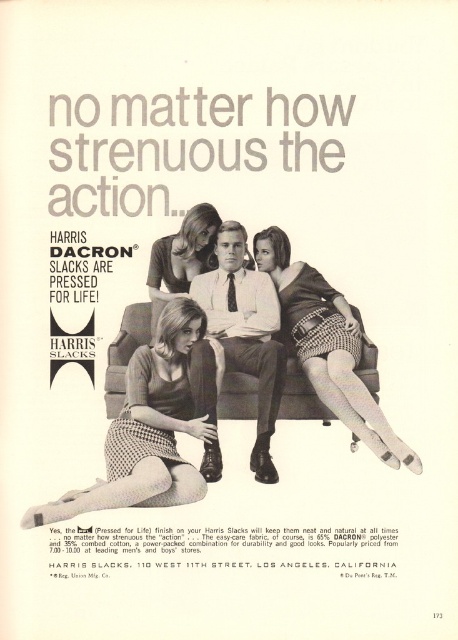
Question: Which of the following is the closest to the observer?

Choices:
 (A) (221, 312)
 (B) (152, 355)
 (C) (243, 380)

Answer: (B)

Question: Which object is closer to the camera taking this photo?

Choices:
 (A) brown leather couch at center
 (B) matte black dress at center

Answer: (A)

Question: Does checkered fabric skirt at center come behind brown leather couch at center?

Choices:
 (A) no
 (B) yes

Answer: (A)

Question: Does houndstooth skirt at center appear under checkered fabric skirt at center?

Choices:
 (A) no
 (B) yes

Answer: (B)

Question: Which of these objects is positioned closest to the matte black slacks at center?

Choices:
 (A) matte black dress at center
 (B) brown leather couch at center

Answer: (A)

Question: Can you confirm if matte black slacks at center is positioned above matte black dress at center?

Choices:
 (A) yes
 (B) no

Answer: (B)